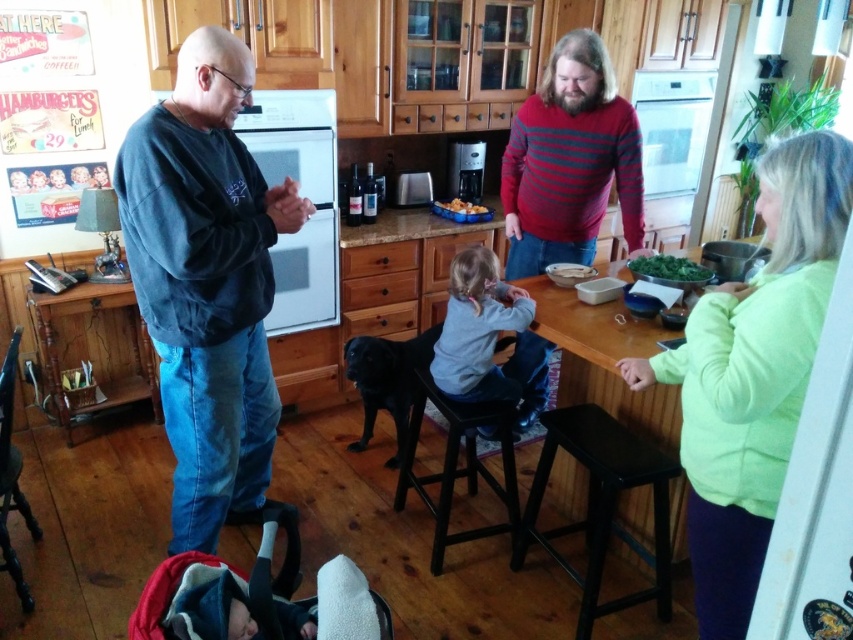
Can you confirm if black wood stool at center is shorter than golden brown crispy chicken at center?

In fact, black wood stool at center may be taller than golden brown crispy chicken at center.

Is black wood stool at center bigger than golden brown crispy chicken at center?

Correct, black wood stool at center is larger in size than golden brown crispy chicken at center.

Describe the element at coordinates (456, 461) in the screenshot. I see `black wood stool at center` at that location.

Locate an element on the screen. This screenshot has width=853, height=640. black wood stool at center is located at coordinates (456, 461).

Can you confirm if red fabric baby carriage at lower left is taller than black wood stool at center?

In fact, red fabric baby carriage at lower left may be shorter than black wood stool at center.

Identify the location of red fabric baby carriage at lower left. (257, 596).

Describe the element at coordinates (257, 596) in the screenshot. I see `red fabric baby carriage at lower left` at that location.

Image resolution: width=853 pixels, height=640 pixels. In order to click on red fabric baby carriage at lower left in this screenshot , I will do `click(257, 596)`.

Is wooden table at center to the left of black smooth dog at center from the viewer's perspective?

In fact, wooden table at center is to the right of black smooth dog at center.

Can you confirm if wooden table at center is positioned above black smooth dog at center?

Yes.

Which is behind, point (639, 528) or point (396, 394)?

Point (396, 394)

The height and width of the screenshot is (640, 853). Identify the location of wooden table at center. (605, 358).